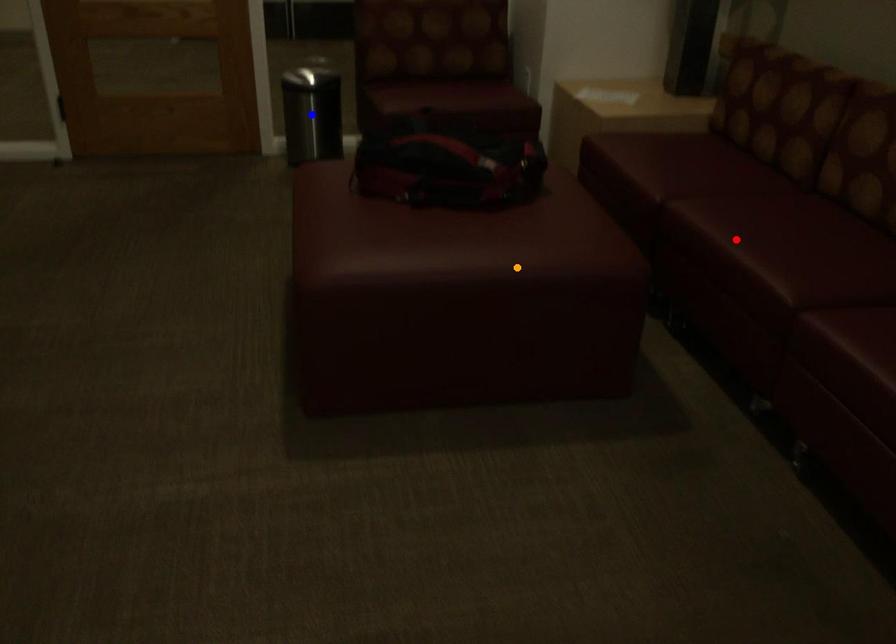
Order these from farthest to nearest:
orange point, red point, blue point

blue point, red point, orange point